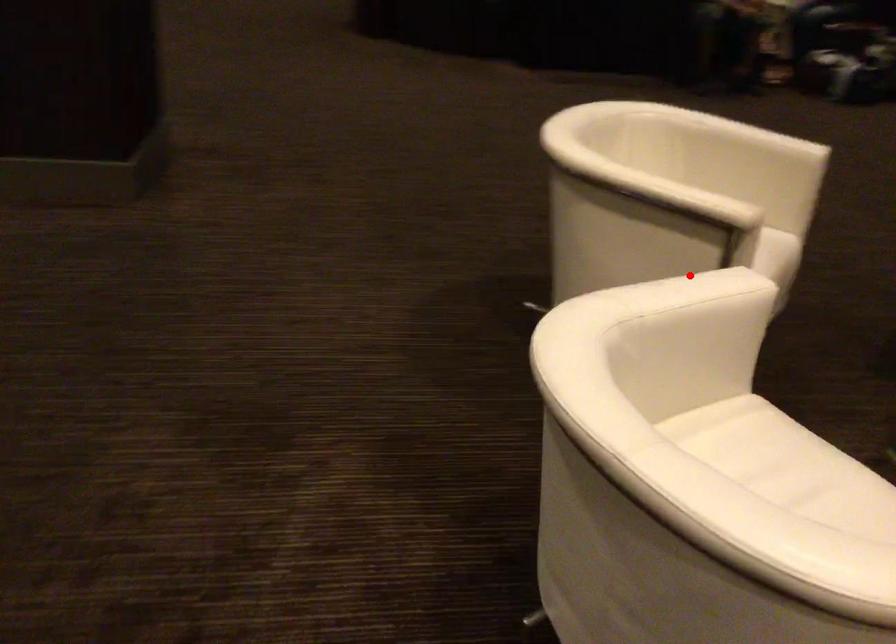
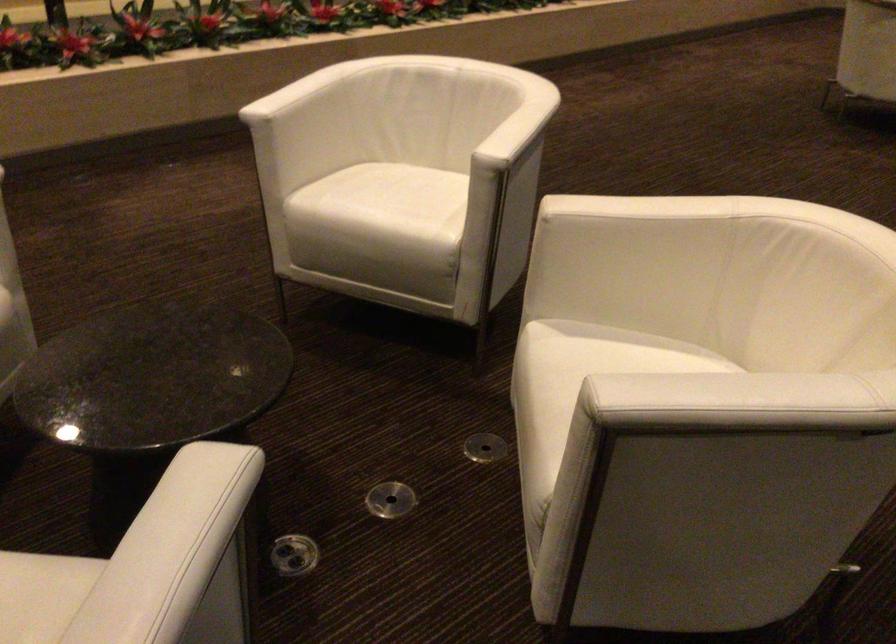
Question: A red point is marked in image1. In image2, is the corresponding 3D point closer to the camera or farther? Reply with the corresponding letter.

Choices:
 (A) The corresponding 3D point is closer.
 (B) The corresponding 3D point is farther.

Answer: (B)